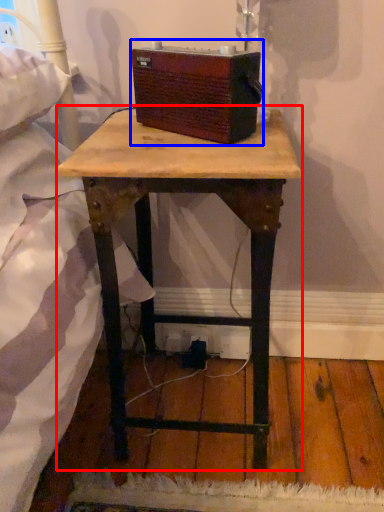
Question: Which point is further to the camera, table (highlighted by a red box) or box (highlighted by a blue box)?

Choices:
 (A) table
 (B) box

Answer: (B)